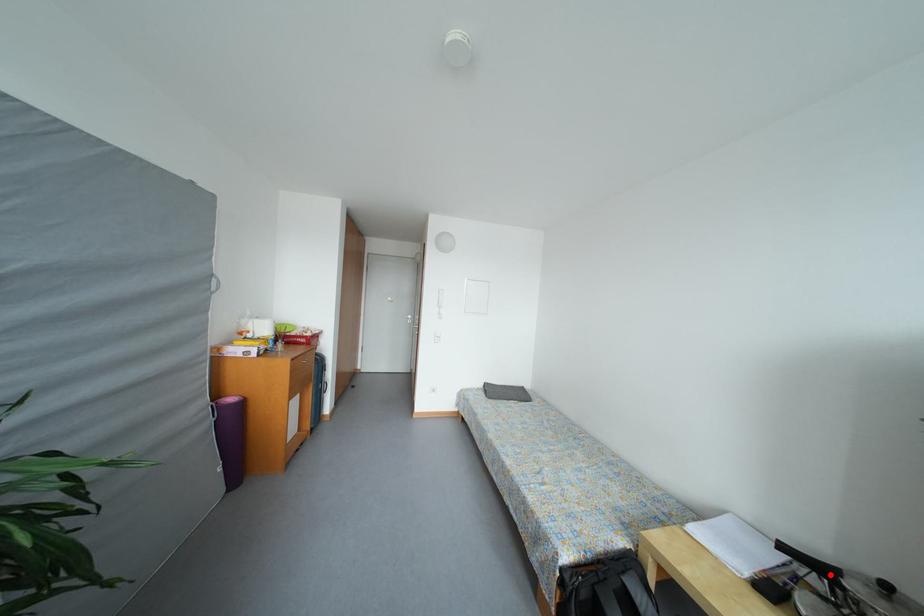
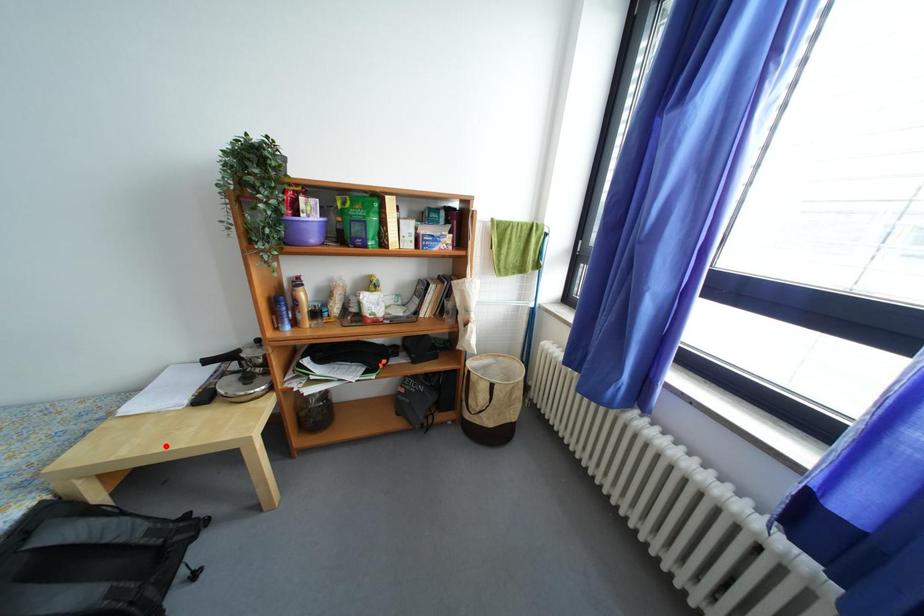
I am providing you with two images of the same scene from different viewpoints. A red point is marked on the first image and another point is marked on the second image. Is the red point in image1 aligned with the point shown in image2?

No